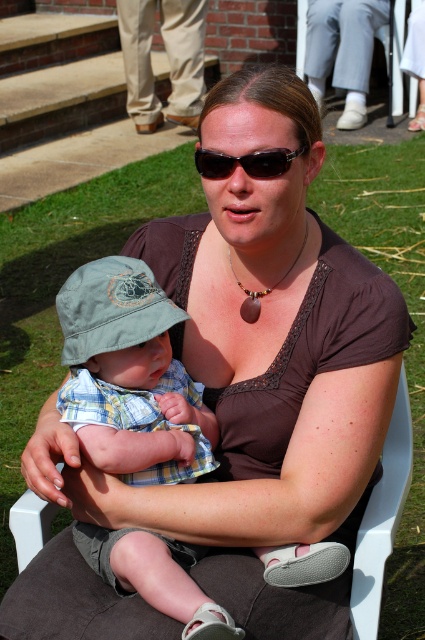
I want to click on white plastic chair at center, so click(x=382, y=518).

Describe the element at coordinates (382, 518) in the screenshot. This screenshot has height=640, width=425. I see `white plastic chair at center` at that location.

Is point (342, 397) positioned before point (226, 164)?

No, (342, 397) is further to viewer.

Where is `white plastic chair at center`? This screenshot has height=640, width=425. white plastic chair at center is located at coordinates (382, 518).

Which is below, black plastic sunglasses at center or brown stone pendant at center?

Positioned lower is brown stone pendant at center.

Is black plastic sunglasses at center further to camera compared to brown stone pendant at center?

No.

Is point (268, 173) closer to viewer compared to point (257, 308)?

Yes, it is in front of point (257, 308).

This screenshot has width=425, height=640. I want to click on black plastic sunglasses at center, so click(246, 163).

Between point (306, 605) and point (249, 323), which one is positioned in front?

Positioned in front is point (306, 605).

Who is positioned more to the left, white plastic chair at center or brown stone pendant at center?

Positioned to the left is white plastic chair at center.

Is point (368, 595) positioned in front of point (238, 280)?

That is True.

Where is `white plastic chair at center`? Image resolution: width=425 pixels, height=640 pixels. white plastic chair at center is located at coordinates (382, 518).